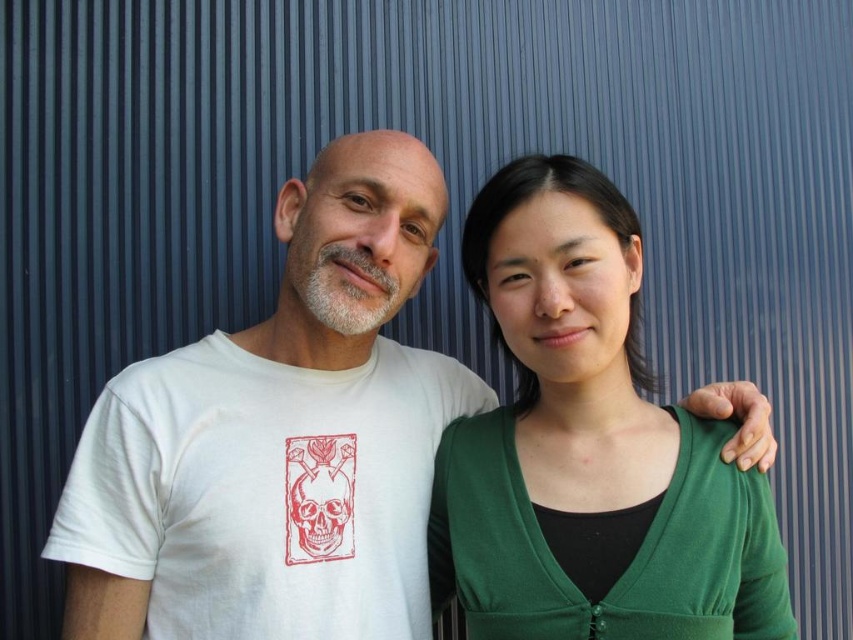
Question: Is green matte cardigan at right wider than white cotton t-shirt at left?

Choices:
 (A) no
 (B) yes

Answer: (A)

Question: Is white matte t-shirt at left wider than white cotton t-shirt at left?

Choices:
 (A) yes
 (B) no

Answer: (B)

Question: Which point appears farthest from the camera in this image?

Choices:
 (A) (368, 141)
 (B) (236, 451)
 (C) (444, 449)

Answer: (C)

Question: Does green matte cardigan at right have a larger size compared to white cotton t-shirt at left?

Choices:
 (A) yes
 (B) no

Answer: (A)

Question: Estimate the real-world distances between objects in this image. Which object is farther from the green matte cardigan at right?

Choices:
 (A) white cotton t-shirt at left
 (B) white matte t-shirt at left

Answer: (A)

Question: Among these objects, which one is nearest to the camera?

Choices:
 (A) white matte t-shirt at left
 (B) white cotton t-shirt at left

Answer: (A)